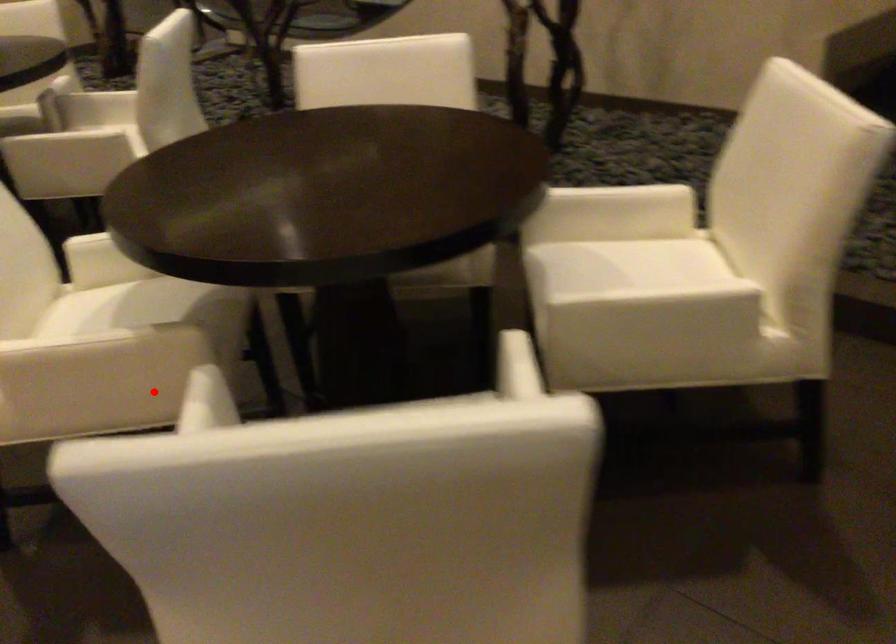
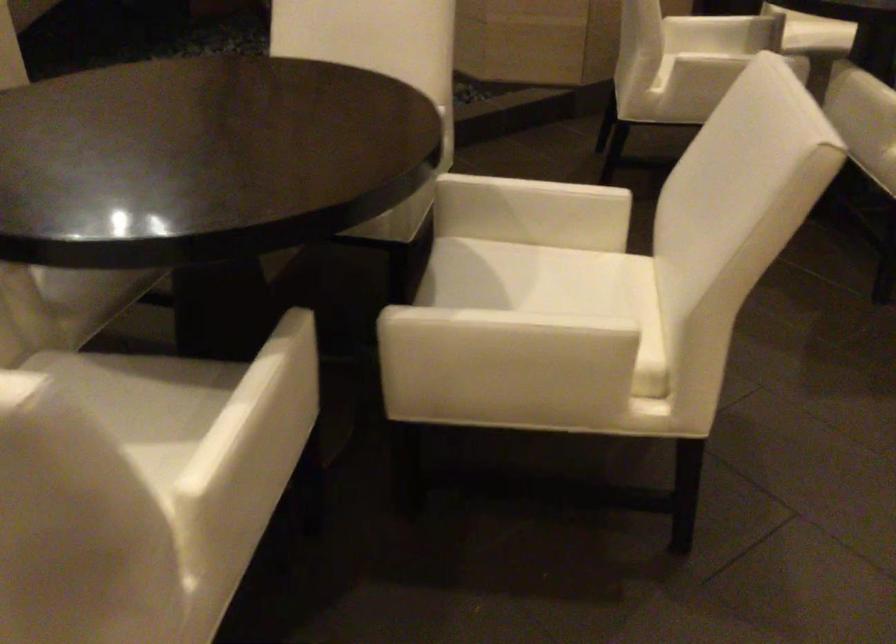
Question: I am providing you with two images of the same scene from different viewpoints. Given a red point in image1, look at the same physical point in image2. Is it:

Choices:
 (A) Closer to the viewpoint
 (B) Farther from the viewpoint

Answer: (A)